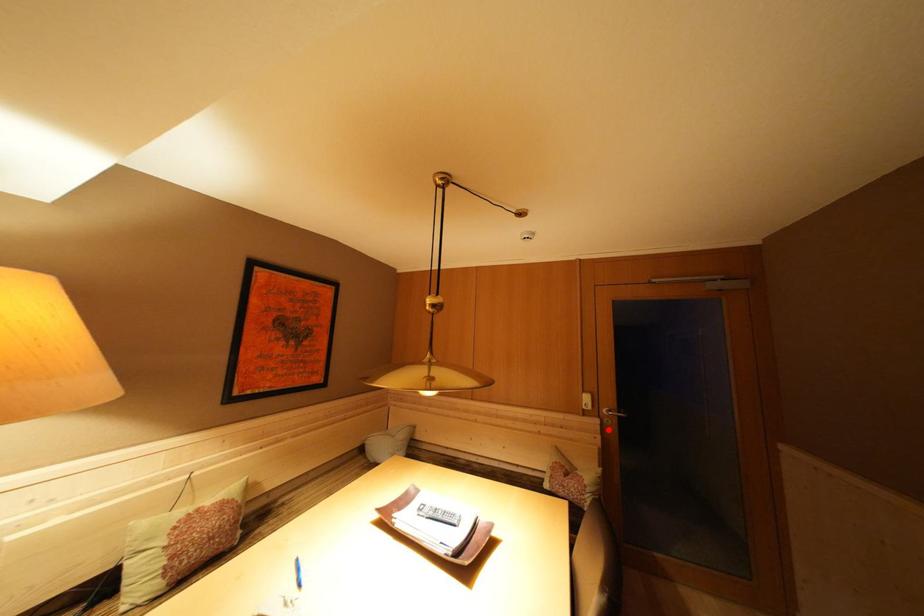
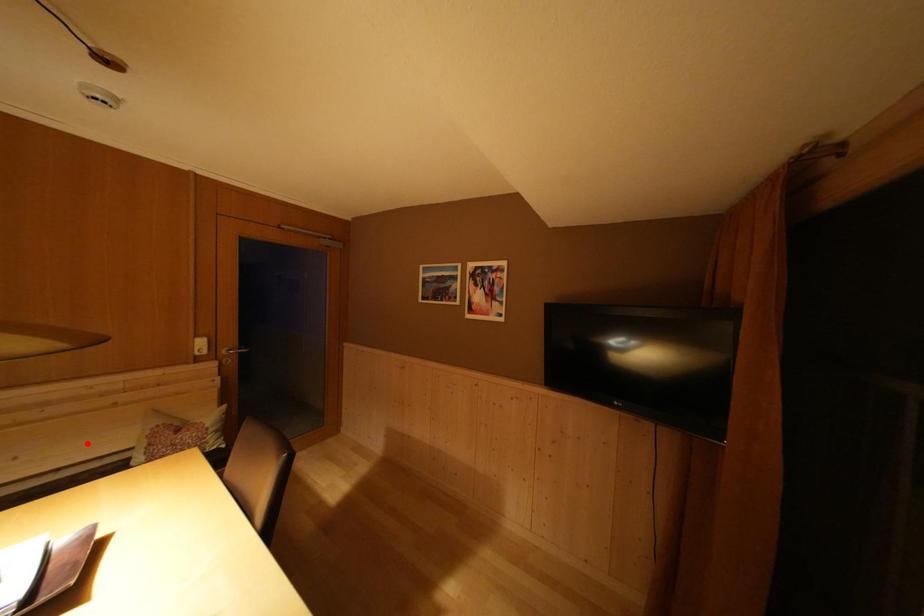
I am providing you with two images of the same scene from different viewpoints. A red point is marked on the first image and another point is marked on the second image. Does the point marked in image1 correspond to the same location as the one in image2?

No